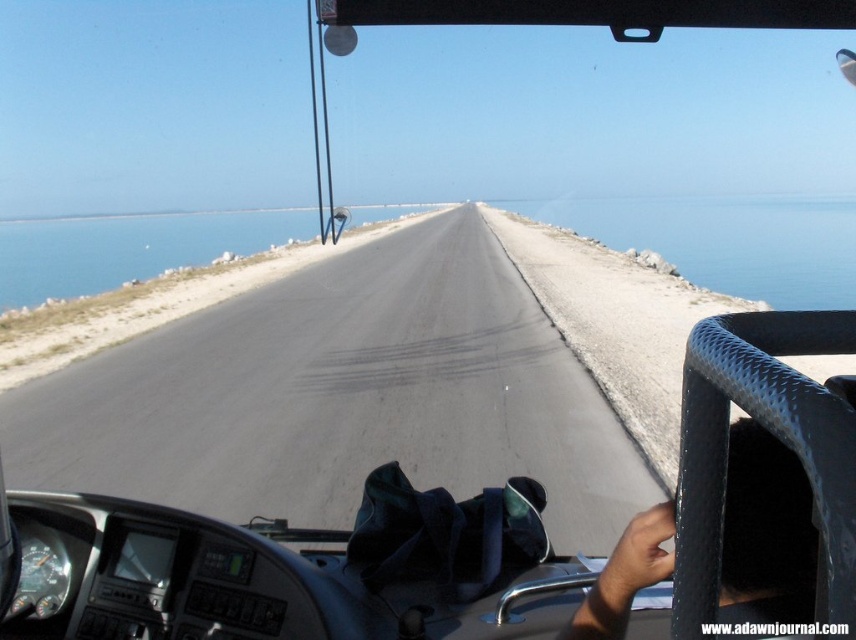
You are a driver navigating a vehicle on the asphalt road at center. The road is bordered by water on both sides. To ensure safety, you need to stay within the road. Based on the coordinates provided, is the point at (342, 396) on the asphalt road at center?

Yes, the point at (342, 396) is on the asphalt road at center as indicated by the coordinates provided.